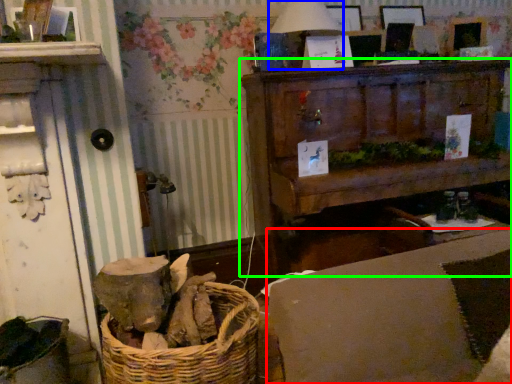
Question: Which is farther away from couch (highlighted by a red box)? table lamp (highlighted by a blue box) or furniture (highlighted by a green box)?

Choices:
 (A) table lamp
 (B) furniture

Answer: (A)